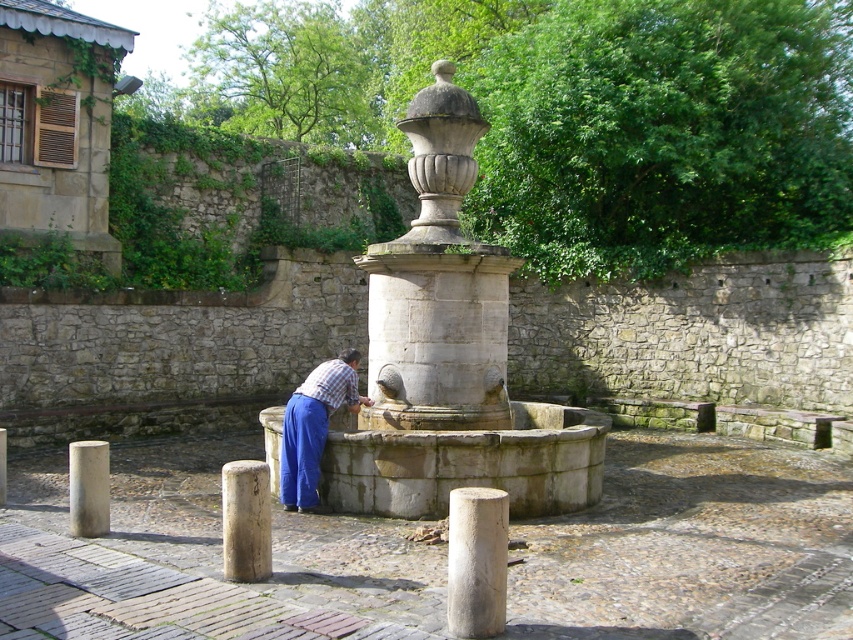
Consider the image. You are a maintenance worker tasked with checking the height of the smooth stone post at lower left and the smooth gray stone pillar at center. Which one do you need to adjust if you have to make them the same height?

The smooth gray stone pillar at center is shorter than the smooth stone post at lower left, so you need to adjust the smooth gray stone pillar at center to match their heights.

You are standing in the courtyard and want to walk directly to the stone fountain at center. There is a smooth gray post at lower left in your path. Which object will you encounter first?

The smooth gray post at lower left is closer to you than the stone fountain at center, so you will encounter the smooth gray post at lower left first before reaching the stone fountain at center.

You are standing in the courtyard and want to walk from the smooth gray post at lower left to the stone fountain at center. Which direction should you move?

The stone fountain at center is to the right of the smooth gray post at lower left, so you should move to the right to reach it.